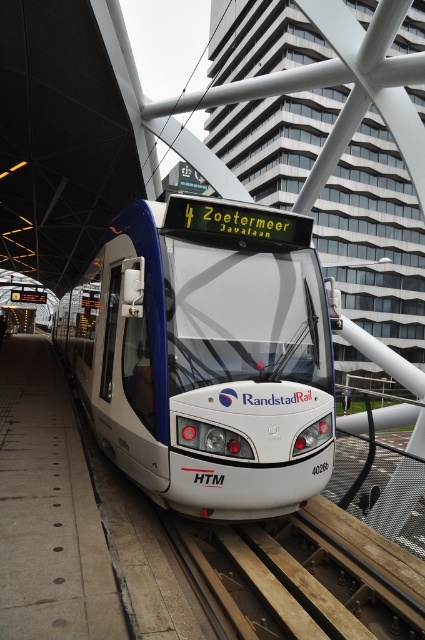
Question: Is white glossy train at center to the left of brown wooden train track at lower center from the viewer's perspective?

Choices:
 (A) no
 (B) yes

Answer: (B)

Question: Can you confirm if white glossy train at center is smaller than brown wooden train track at lower center?

Choices:
 (A) no
 (B) yes

Answer: (A)

Question: Among these points, which one is farthest from the camera?

Choices:
 (A) (232, 604)
 (B) (167, 356)

Answer: (B)

Question: Does white glossy train at center have a lesser width compared to brown wooden train track at lower center?

Choices:
 (A) no
 (B) yes

Answer: (A)

Question: Which object is farther from the camera taking this photo?

Choices:
 (A) white glossy train at center
 (B) brown wooden train track at lower center

Answer: (A)